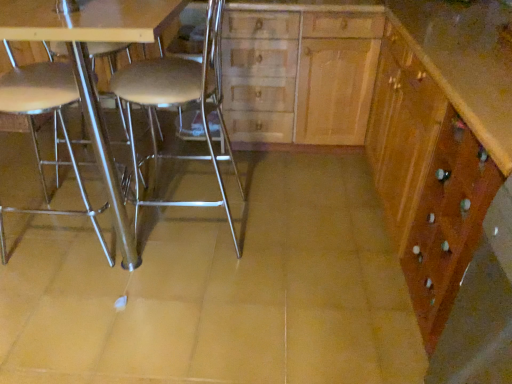
This screenshot has width=512, height=384. What are the coordinates of `free space that is in between metallic silver stool at center, placed as the 2th chair when sorted from left to right, and metallic silver table at center` in the screenshot? It's located at (233, 197).